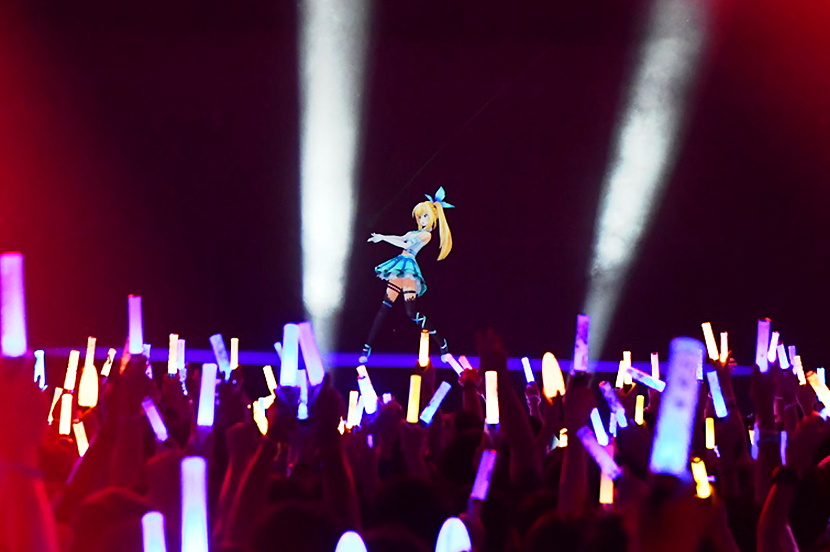
Find the location of a particular element. This screenshot has height=552, width=830. glow lights is located at coordinates (492, 405), (559, 366), (427, 349), (415, 398), (374, 394).